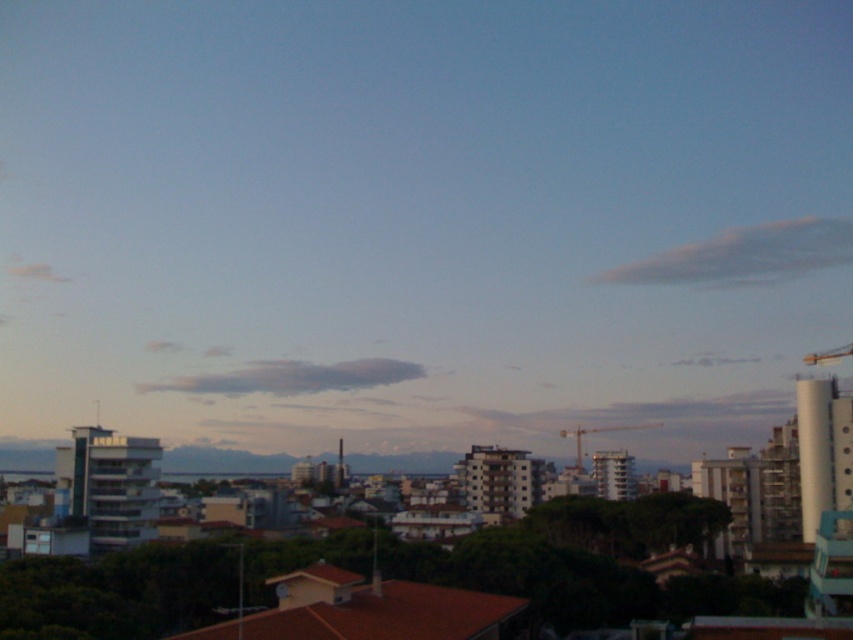
Question: Which of the following is the farthest from the observer?

Choices:
 (A) metallic construction crane at center
 (B) metallic yellow crane at upper right

Answer: (A)

Question: Can you confirm if metallic construction crane at center is smaller than metallic yellow crane at upper right?

Choices:
 (A) no
 (B) yes

Answer: (A)

Question: Does metallic construction crane at center appear on the left side of metallic yellow crane at upper right?

Choices:
 (A) yes
 (B) no

Answer: (A)

Question: Can you confirm if metallic construction crane at center is bigger than metallic yellow crane at upper right?

Choices:
 (A) yes
 (B) no

Answer: (A)

Question: Which point is farther to the camera?

Choices:
 (A) metallic yellow crane at upper right
 (B) metallic construction crane at center

Answer: (B)